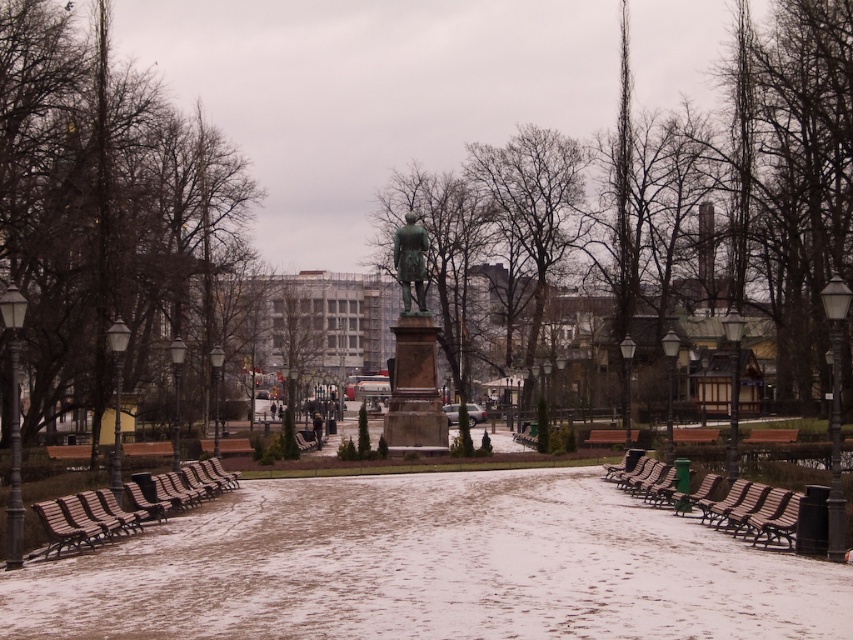
Does point (451, 339) come behind point (418, 227)?

Yes, point (451, 339) is behind point (418, 227).

Who is more forward, (467, 356) or (426, 400)?

Point (426, 400)

What do you see at coordinates (453, 266) in the screenshot?
I see `green polished statue at center` at bounding box center [453, 266].

The image size is (853, 640). I want to click on green polished statue at center, so click(453, 266).

Which is in front, point (428, 266) or point (480, 182)?

Positioned in front is point (428, 266).

Is green leafless tree at center positioned at the back of bare branches at center?

No.

Is point (827, 240) farther from viewer compared to point (564, 160)?

No, (827, 240) is closer to viewer.

Image resolution: width=853 pixels, height=640 pixels. Identify the location of green leafless tree at center. (741, 188).

From the picture: Is green leafless tree at center positioned before green polished statue at center?

Yes, it is.

Is point (735, 67) positioned in front of point (386, 188)?

Yes, point (735, 67) is in front of point (386, 188).

This screenshot has height=640, width=853. Find the location of `green leafless tree at center`. green leafless tree at center is located at coordinates (741, 188).